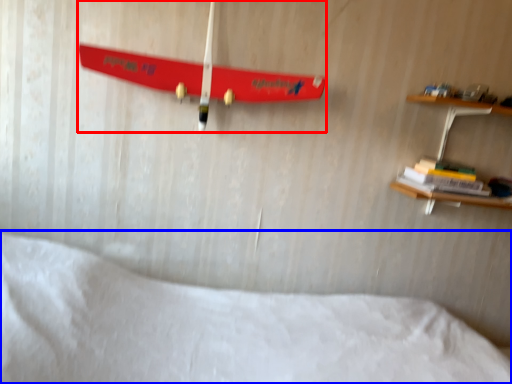
Question: Among these objects, which one is farthest to the camera, skateboard (highlighted by a red box) or bed (highlighted by a blue box)?

Choices:
 (A) skateboard
 (B) bed

Answer: (A)